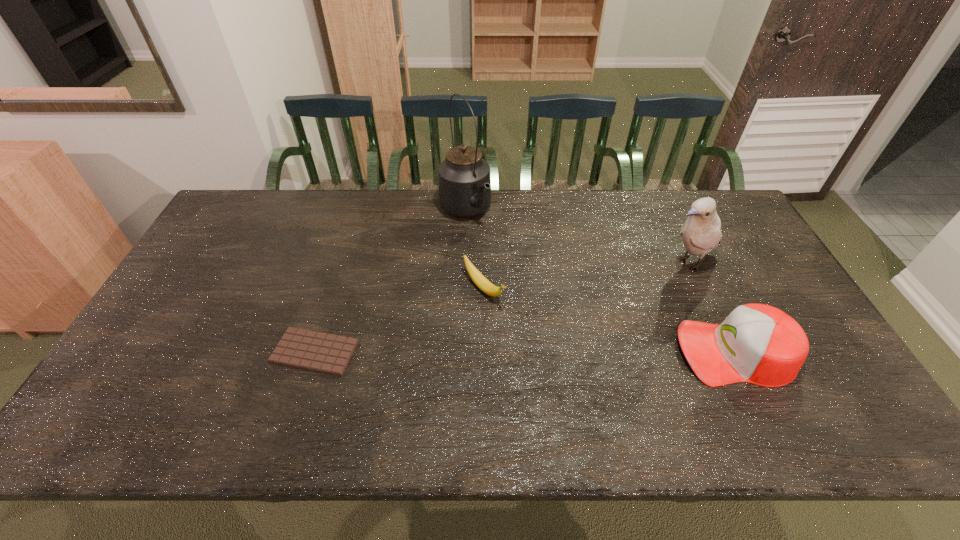
Identify the location of free region at the far left corner of the desktop. (241, 224).

Identify the location of empty location between the banana and the farthest object. The width and height of the screenshot is (960, 540). (474, 250).

Where is `empty space that is in between the tallest object and the baseball cap`? Image resolution: width=960 pixels, height=540 pixels. empty space that is in between the tallest object and the baseball cap is located at coordinates (600, 281).

At what (x,y) coordinates should I click in order to perform the action: click on vacant space in between the tallest object and the banana. Please return your answer as a coordinate pair (x, y). Looking at the image, I should click on (474, 250).

The width and height of the screenshot is (960, 540). Find the location of `vacant space that's between the kettle and the leftmost object`. vacant space that's between the kettle and the leftmost object is located at coordinates (390, 281).

Where is `vacant area that lies between the kettle and the fourth shortest object`? vacant area that lies between the kettle and the fourth shortest object is located at coordinates (x=576, y=237).

Identify the location of free space between the leftmost object and the second tallest object. The height and width of the screenshot is (540, 960). [501, 307].

Where is `vacant area that lies between the banana and the shortest object`? vacant area that lies between the banana and the shortest object is located at coordinates (399, 320).

Find the location of a particular element. free space between the banana and the baseball cap is located at coordinates (610, 321).

Image resolution: width=960 pixels, height=540 pixels. What are the coordinates of `free space that is in between the banana and the bird` in the screenshot? It's located at (586, 276).